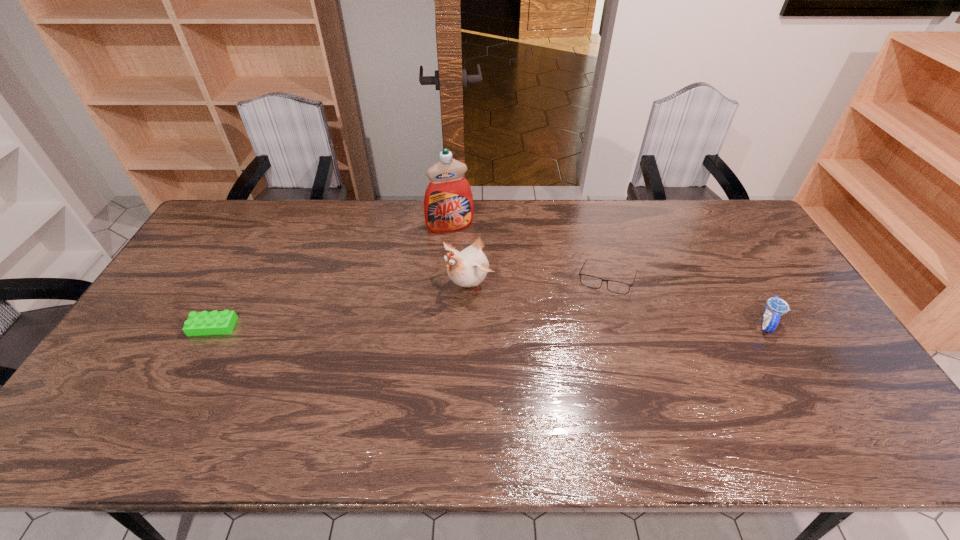
This screenshot has width=960, height=540. What are the coordinates of `the leftmost object` in the screenshot? It's located at pos(216,322).

I want to click on Lego, so click(216, 322).

Find the location of a particular element. This screenshot has height=540, width=960. watch is located at coordinates (776, 307).

Find the location of a particular element. the rightmost object is located at coordinates (776, 307).

The width and height of the screenshot is (960, 540). Identify the location of spectacles. (590, 281).

Locate an element on the screen. the fourth tallest object is located at coordinates (590, 281).

Locate an element on the screen. detergent is located at coordinates (448, 203).

The height and width of the screenshot is (540, 960). In order to click on the farthest object in this screenshot , I will do `click(448, 203)`.

At what (x,y) coordinates should I click in order to perform the action: click on bird. Please return your answer as a coordinate pair (x, y). Looking at the image, I should click on (468, 268).

Where is `free space located 0.220m on the front of the Lego`? Image resolution: width=960 pixels, height=540 pixels. free space located 0.220m on the front of the Lego is located at coordinates (168, 409).